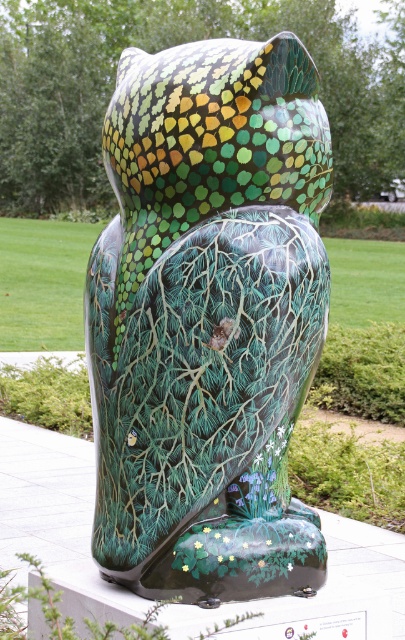
Question: Does glossy ceramic owl at center lie in front of green glossy owl at center?

Choices:
 (A) no
 (B) yes

Answer: (B)

Question: Is glossy ceramic owl at center to the left of green glossy owl at center from the viewer's perspective?

Choices:
 (A) yes
 (B) no

Answer: (A)

Question: Does glossy ceramic owl at center appear under green glossy owl at center?

Choices:
 (A) yes
 (B) no

Answer: (A)

Question: Which point is closer to the camera taking this photo?

Choices:
 (A) (247, 144)
 (B) (321, 13)

Answer: (A)